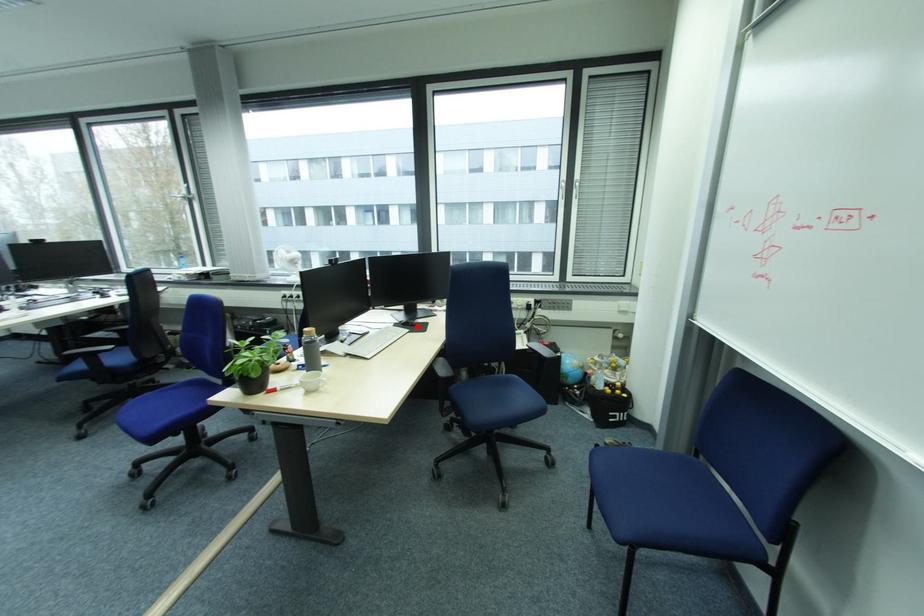
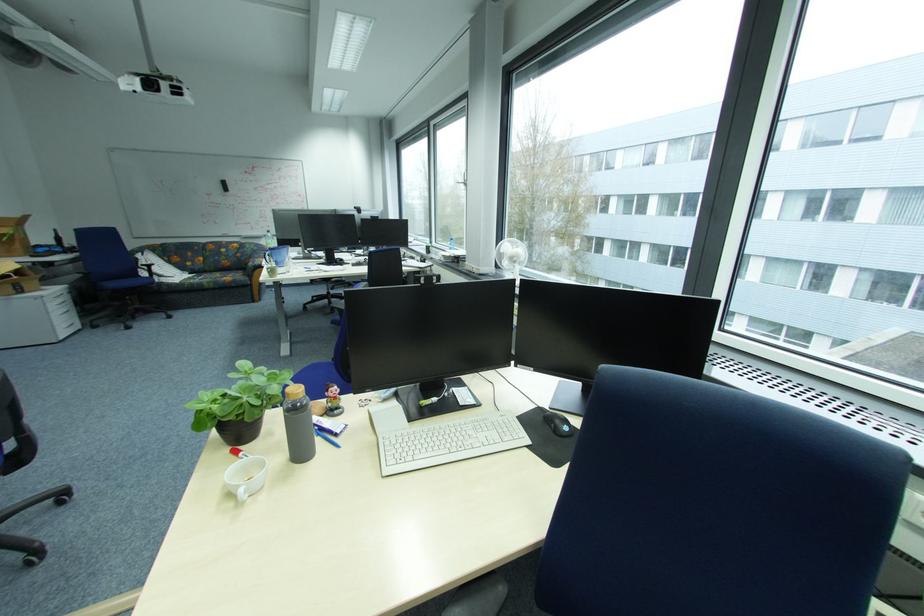
Locate, in the second image, the point that corresponds to the highlighted location in the first image.

(560, 428)